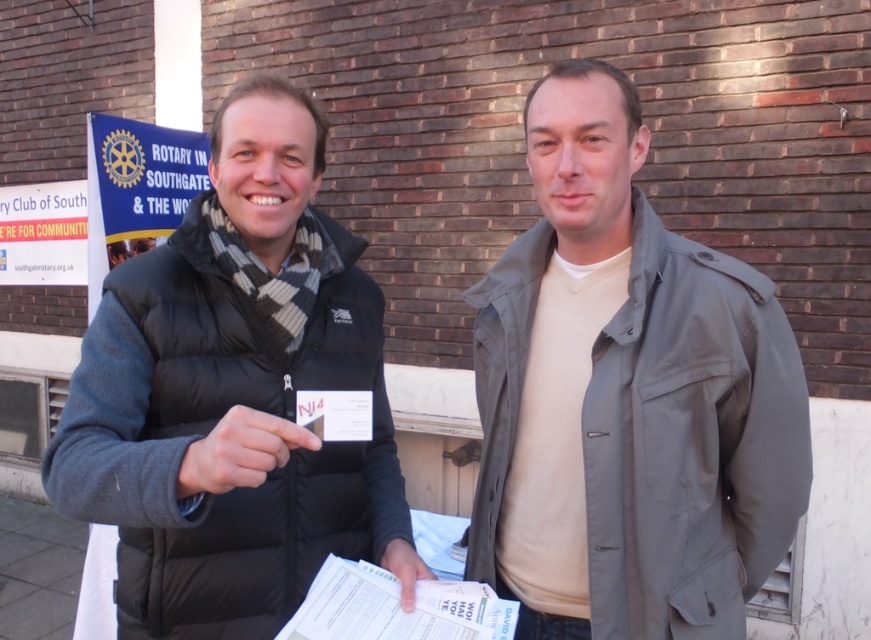
You are a photographer standing at a distance of 35 inches from the scene. You want to take a closeup photo of the black puffer vest at left without moving closer. Is the distance sufficient for a clear closeup?

The black puffer vest at left is 35.57 inches from viewer, so the distance of 35 inches is slightly too far for a clear closeup photo. You need to move 0.57 inches closer to capture the black puffer vest at left clearly.

You are a photographer setting up for an event. You need to position a backdrop that is 1.8 meters tall. The backdrop needs to be placed behind the light gray fabric jacket at center and the black puffer vest at left so that both are fully visible. Given the height difference between them, will the backdrop be sufficient in height to cover both?

The light gray fabric jacket at center is taller than the black puffer vest at left. Since the backdrop is 1.8 meters tall, it will be sufficient to cover both individuals as long as their combined height does not exceed the backdrop height. However, without knowing their exact heights, we can only confirm the backdrop is taller than the taller individual, the light gray fabric jacket at center, so it should adequately cover both.

You are a photographer setting up for a group photo. You need to ensure that the light gray fabric jacket at center is clearly visible in the frame. Given that the jacket is 1.20 meters from the camera, what is the minimum distance the photographer should maintain to ensure the jacket remains in focus if the camera has a depth of field of 1.0 meters?

The light gray fabric jacket at center is 1.20 meters from the camera. Since the depth of field is 1.0 meters, the photographer must position themselves no more than 0.2 meters behind the jacket to keep it within the focus range. Alternatively, if focusing on the jacket, the camera should be placed between 1.20 meters and 2.20 meters away to ensure the jacket stays sharp.